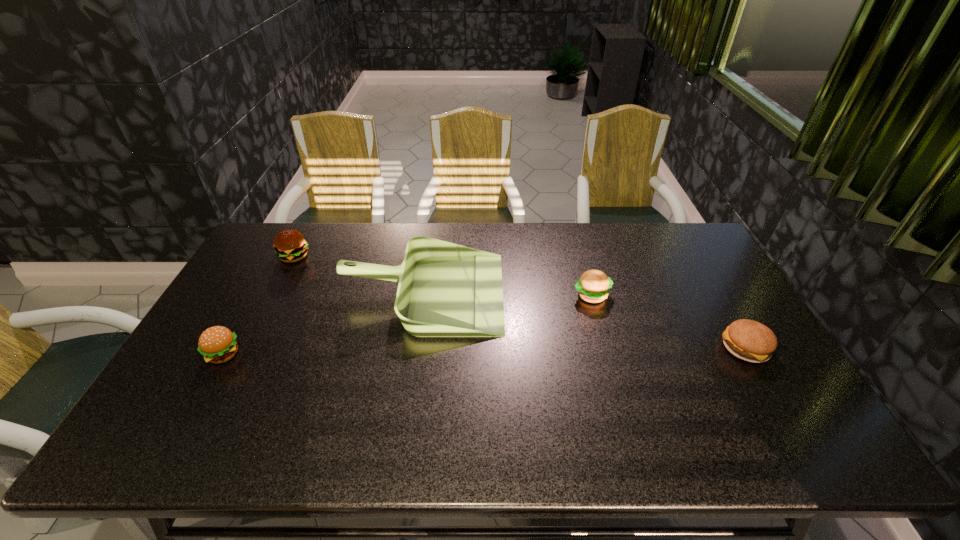
The image size is (960, 540). In order to click on vacant point located between the fourth object from left to right and the tallest object in this screenshot , I will do `click(507, 294)`.

I want to click on free space between the farthest hamburger and the shortest hamburger, so click(x=519, y=302).

Find the location of a particular element. free space between the shortest hamburger and the fourth object from left to right is located at coordinates (668, 321).

Where is `free point between the rightmost object and the dustpan`? This screenshot has width=960, height=540. free point between the rightmost object and the dustpan is located at coordinates (584, 320).

You are a GUI agent. You are given a task and a screenshot of the screen. Output one action in this format:
    pyautogui.click(x=<x>, y=<y>)
    Task: Click on the free space between the shortest hamburger and the third object from left to right
    
    Given the screenshot: What is the action you would take?
    pyautogui.click(x=584, y=320)

Where is `the second closest object relative to the farthest hamburger`? the second closest object relative to the farthest hamburger is located at coordinates (217, 344).

Identify the location of object that is the closest one to the farthest hamburger. (445, 290).

Image resolution: width=960 pixels, height=540 pixels. In order to click on hamburger that is the fourth nearest to the tallest object in this screenshot , I will do `click(748, 340)`.

Locate an element on the screen. The height and width of the screenshot is (540, 960). the third closest hamburger to the shortest hamburger is located at coordinates (217, 344).

Locate an element on the screen. The width and height of the screenshot is (960, 540). vacant point that satisfies the following two spatial constraints: 1. on the scoop of the third object from right to left; 2. on the right side of the second object from right to left is located at coordinates (422, 295).